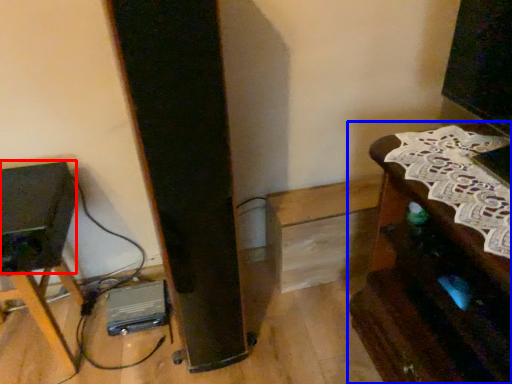
Question: Which of the following is the closest to the observer, speaker (highlighted by a red box) or furniture (highlighted by a blue box)?

Choices:
 (A) speaker
 (B) furniture

Answer: (B)